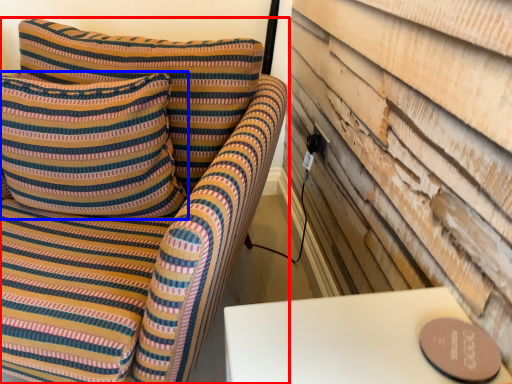
Question: Which of the following is the closest to the observer, furniture (highlighted by a red box) or pillow (highlighted by a blue box)?

Choices:
 (A) furniture
 (B) pillow

Answer: (A)